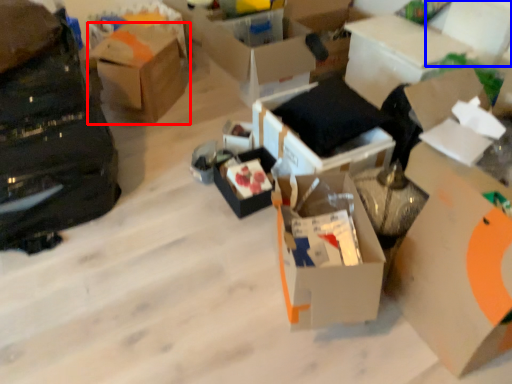
Question: Which object is closer to the camera taking this photo, box (highlighted by a red box) or storage box (highlighted by a blue box)?

Choices:
 (A) box
 (B) storage box

Answer: (B)